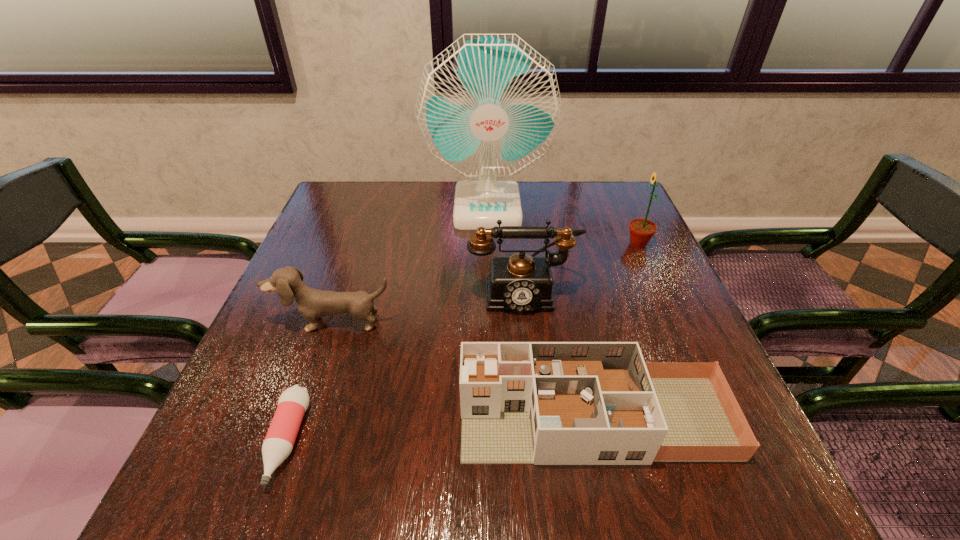
The height and width of the screenshot is (540, 960). I want to click on fan, so tap(488, 105).

Locate an element on the screen. The height and width of the screenshot is (540, 960). the farthest object is located at coordinates (488, 105).

Identify the location of the fifth nearest object. The width and height of the screenshot is (960, 540). (641, 230).

Where is `telephone`? telephone is located at coordinates (521, 283).

Where is `puppy`? puppy is located at coordinates (312, 304).

The width and height of the screenshot is (960, 540). In order to click on the fifth tallest object in this screenshot , I will do [545, 403].

You are a GUI agent. You are given a task and a screenshot of the screen. Output one action in this format:
    pyautogui.click(x=<x>, y=<y>)
    Task: Click on the bottle
    
    Given the screenshot: What is the action you would take?
    pyautogui.click(x=279, y=441)

This screenshot has width=960, height=540. I want to click on vacant position located 0.050m in front of the farthest object to face the airflow, so click(x=488, y=241).

Find the location of `vacant area located 0.230m on the face of the sunflower`. vacant area located 0.230m on the face of the sunflower is located at coordinates (538, 244).

You are a GUI agent. You are given a task and a screenshot of the screen. Output one action in this format:
    pyautogui.click(x=<x>, y=<y>)
    Task: Click on the vacant space located 0.180m on the face of the sunflower
    The image size is (960, 540).
    Given the screenshot: What is the action you would take?
    pyautogui.click(x=557, y=244)